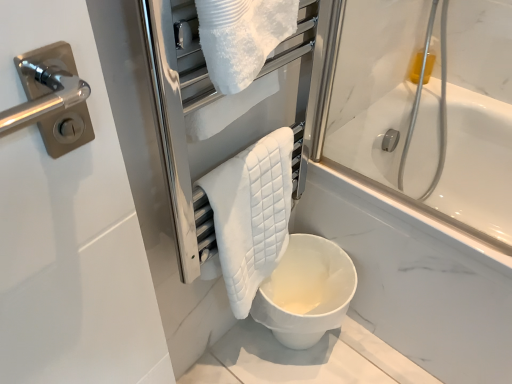
Question: Is white quilted towel at center taller than white quilted towel at center?

Choices:
 (A) yes
 (B) no

Answer: (A)

Question: Can you confirm if white quilted towel at center is positioned to the right of white quilted towel at center?

Choices:
 (A) yes
 (B) no

Answer: (A)

Question: From the image's perspective, is white quilted towel at center over white quilted towel at center?

Choices:
 (A) yes
 (B) no

Answer: (A)

Question: Considering the relative sizes of white quilted towel at center and white quilted towel at center in the image provided, is white quilted towel at center smaller than white quilted towel at center?

Choices:
 (A) yes
 (B) no

Answer: (B)

Question: Is white quilted towel at center bigger than white quilted towel at center?

Choices:
 (A) no
 (B) yes

Answer: (B)

Question: From a real-world perspective, is white quilted towel at center above or below white matte toilet at lower center?

Choices:
 (A) below
 (B) above

Answer: (B)

Question: Based on their sizes in the image, would you say white quilted towel at center is bigger or smaller than white matte toilet at lower center?

Choices:
 (A) small
 (B) big

Answer: (A)

Question: Looking at their shapes, would you say white quilted towel at center is wider or thinner than white matte toilet at lower center?

Choices:
 (A) wide
 (B) thin

Answer: (B)

Question: Visually, is white quilted towel at center positioned to the left or to the right of white matte toilet at lower center?

Choices:
 (A) left
 (B) right

Answer: (A)

Question: Considering the positions of white matte toilet at lower center and white quilted towel at center in the image, is white matte toilet at lower center wider or thinner than white quilted towel at center?

Choices:
 (A) wide
 (B) thin

Answer: (A)

Question: Is white matte toilet at lower center in front of or behind white quilted towel at center in the image?

Choices:
 (A) behind
 (B) front

Answer: (A)

Question: From the image's perspective, is white matte toilet at lower center above or below white quilted towel at center?

Choices:
 (A) above
 (B) below

Answer: (B)

Question: Visually, is white matte toilet at lower center positioned to the left or to the right of white quilted towel at center?

Choices:
 (A) right
 (B) left

Answer: (A)

Question: Is point pyautogui.click(x=244, y=221) positioned closer to the camera than point pyautogui.click(x=180, y=91)?

Choices:
 (A) farther
 (B) closer

Answer: (A)

Question: From a real-world perspective, is white quilted towel at center positioned above or below white quilted towel at center?

Choices:
 (A) above
 (B) below

Answer: (B)